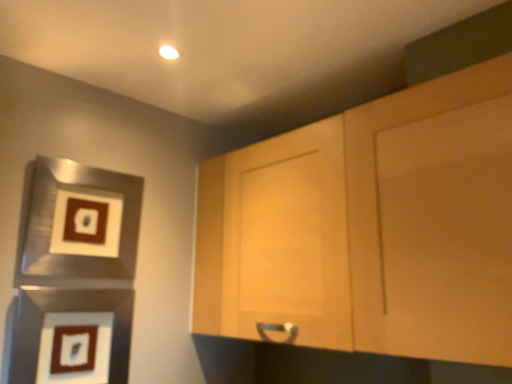
Question: Is matte black picture frame at lower left, positioned as the second picture frame in top-to-bottom order, in front of or behind light wood cabinet at upper right in the image?

Choices:
 (A) front
 (B) behind

Answer: (B)

Question: Would you say matte black picture frame at lower left, positioned as the second picture frame in top-to-bottom order, is to the left or to the right of light wood cabinet at upper right in the picture?

Choices:
 (A) left
 (B) right

Answer: (A)

Question: Which object is positioned closest to the matte black picture frame at lower left, positioned as the second picture frame in top-to-bottom order?

Choices:
 (A) brushed metal picture frame at left, which appears as the 1th picture frame when viewed from the top
 (B) light wood cabinet at upper right

Answer: (A)

Question: Which object is positioned closest to the light wood cabinet at upper right?

Choices:
 (A) brushed metal picture frame at left, which appears as the 1th picture frame when viewed from the top
 (B) matte black picture frame at lower left, positioned as the second picture frame in top-to-bottom order

Answer: (A)